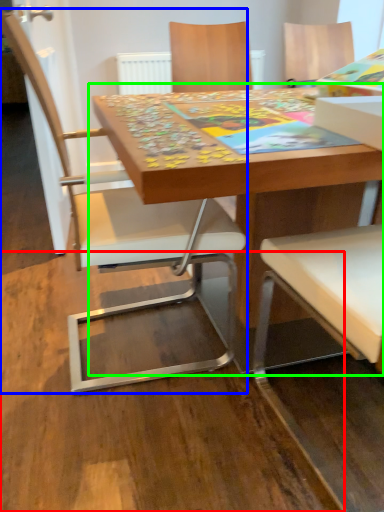
Question: Which object is positioned closest to plywood (highlighted by a red box)? Select from chair (highlighted by a blue box) and table (highlighted by a green box).

Choices:
 (A) chair
 (B) table

Answer: (A)